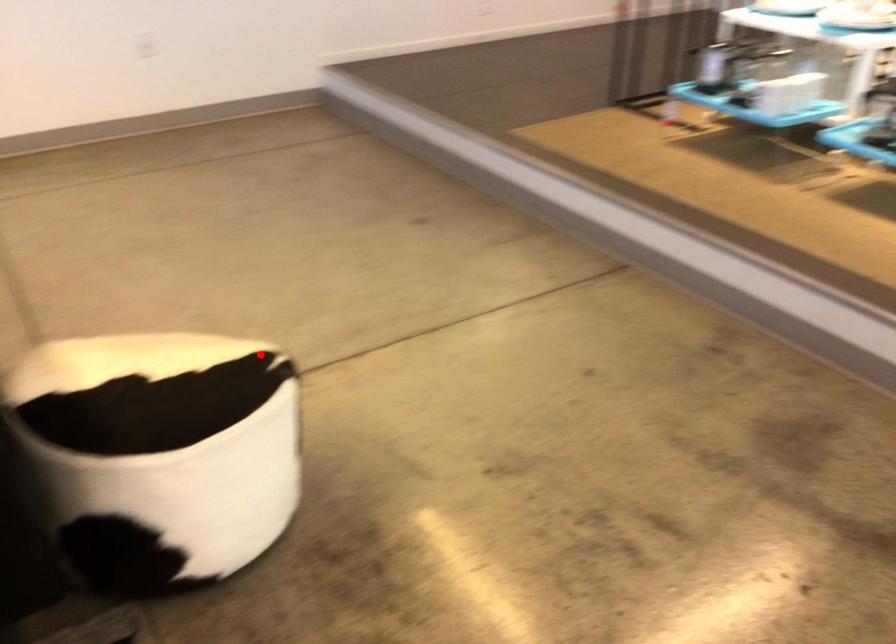
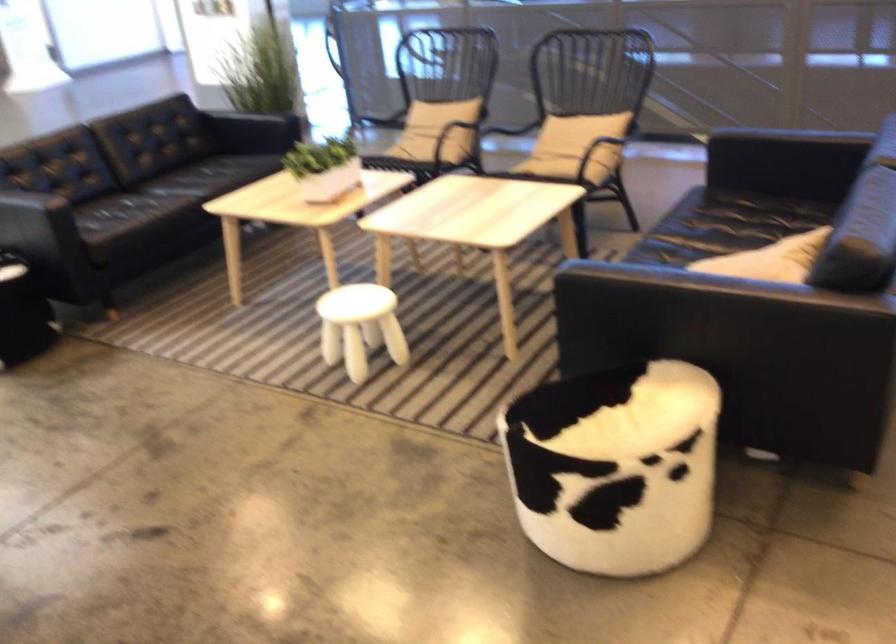
Question: I am providing you with two images of the same scene from different viewpoints. A red point is shown in image1. For the corresponding object point in image2, is it positioned nearer or farther from the camera?

Choices:
 (A) Nearer
 (B) Farther

Answer: (B)